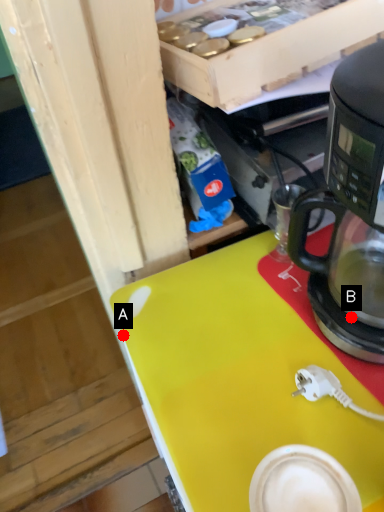
Question: Two points are circled on the image, labeled by A and B beside each circle. Which point is further to the camera?

Choices:
 (A) A is further
 (B) B is further

Answer: (A)